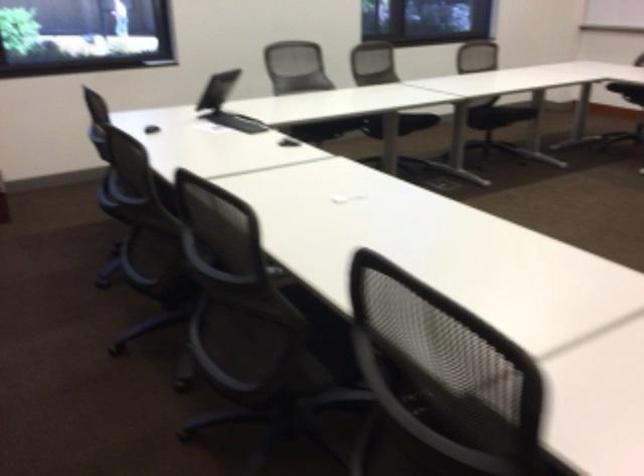
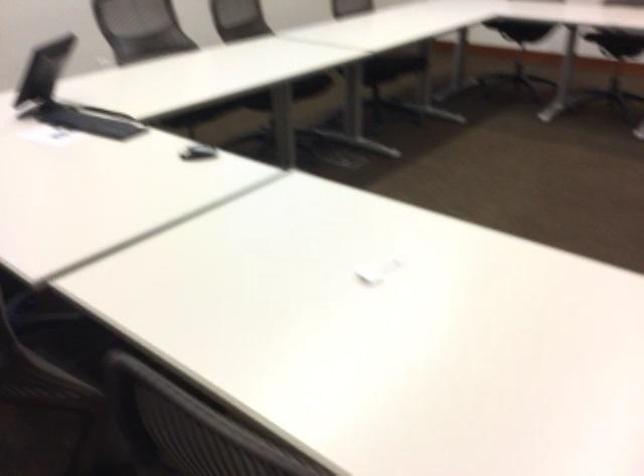
Based on the continuous images, in which direction is the camera rotating?

The camera's rotation is toward right-down.